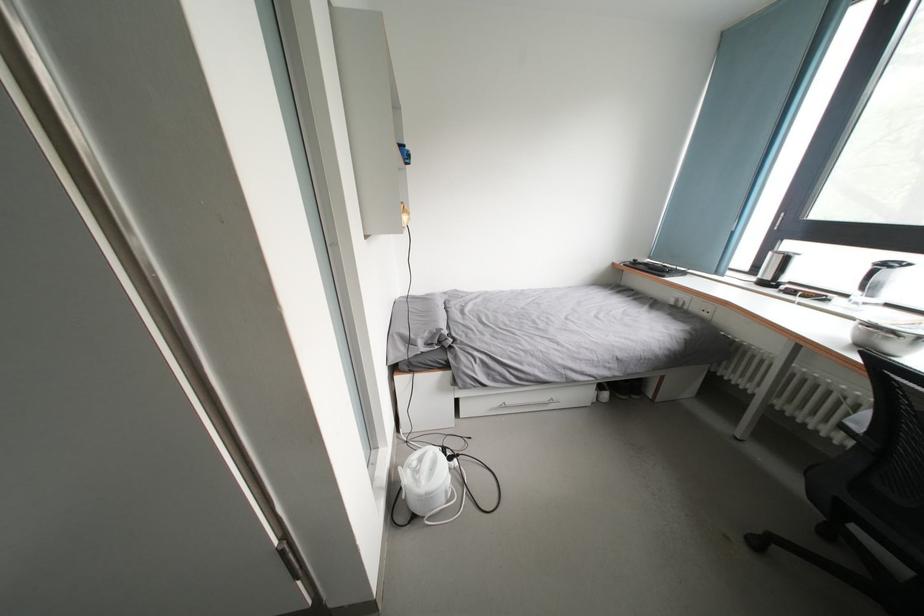
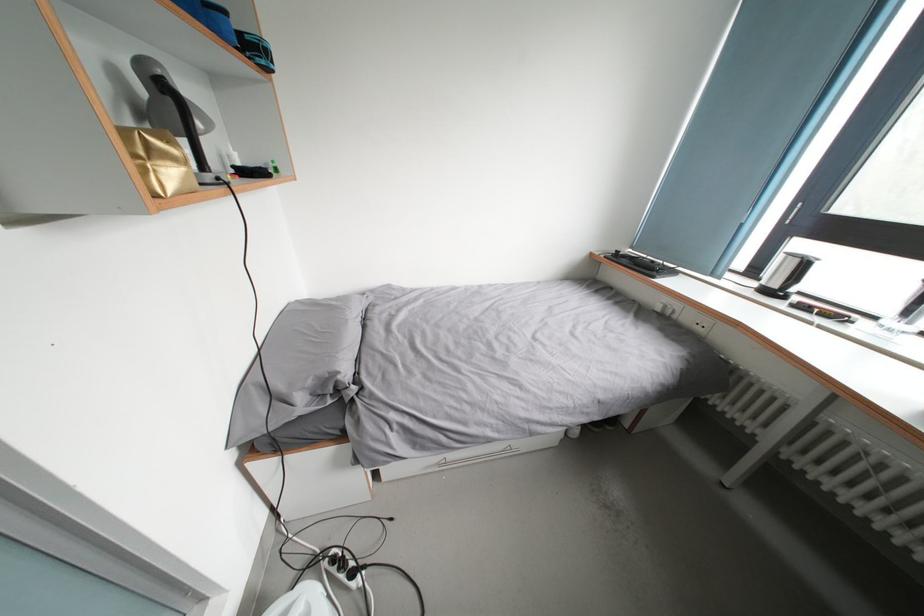
Question: How did the camera likely rotate?

Choices:
 (A) Left
 (B) Right
 (C) Up
 (D) Down

Answer: (B)